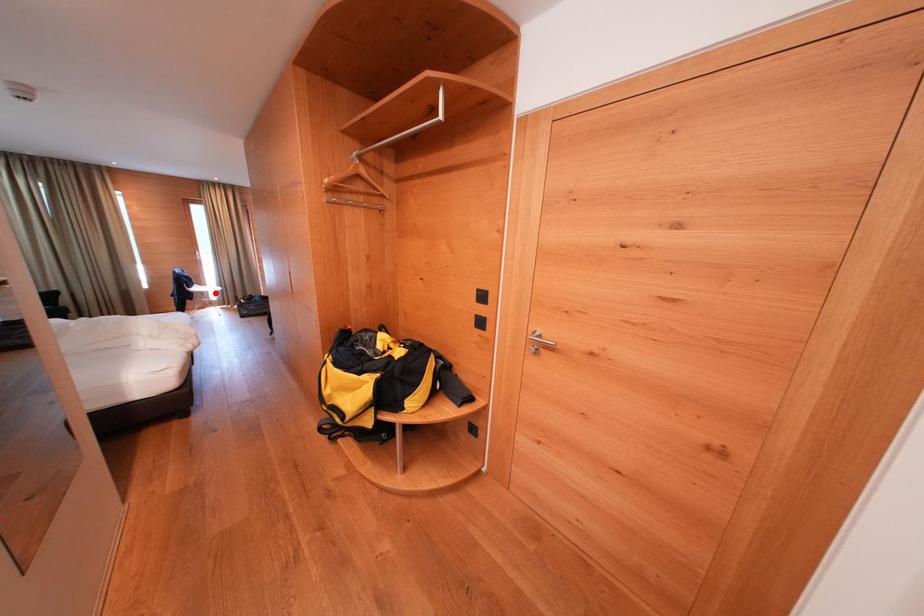
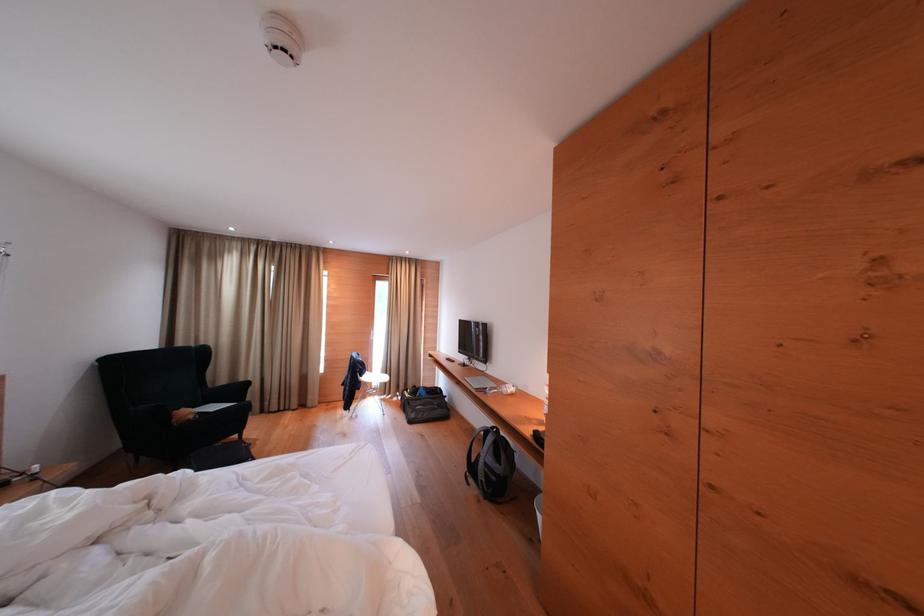
Question: I am providing you with two images of the same scene from different viewpoints. Given a red point in image1, look at the same physical point in image2. Is it:

Choices:
 (A) Closer to the viewpoint
 (B) Farther from the viewpoint

Answer: (B)